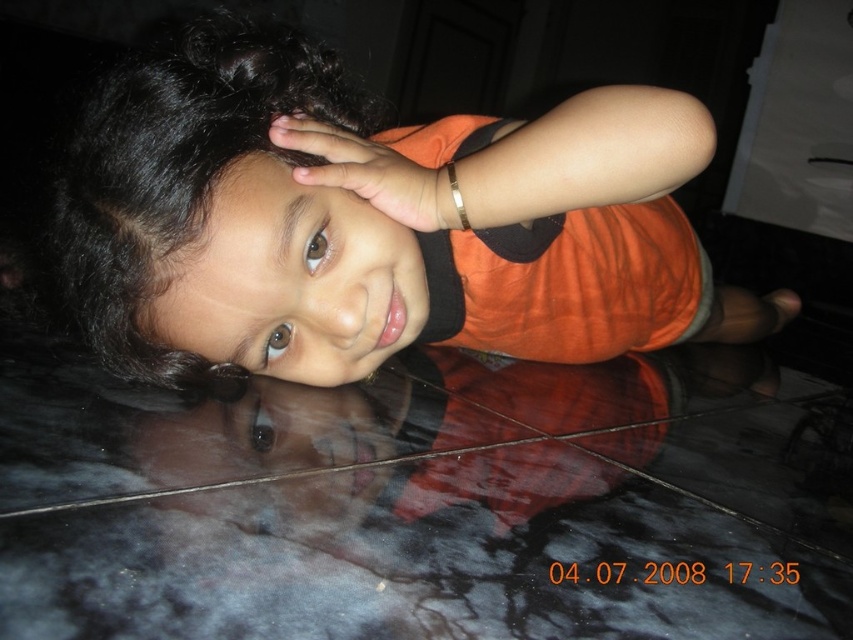
You are a photographer setting up for a portrait. You want to ensure the black curly hair at center is in focus. If your camera has a depth of field of 20 inches, will the hair be in focus?

The black curly hair at center is 23.49 inches from the viewer, which is beyond the camera depth of field of 20 inches. Therefore, the hair will not be in focus.